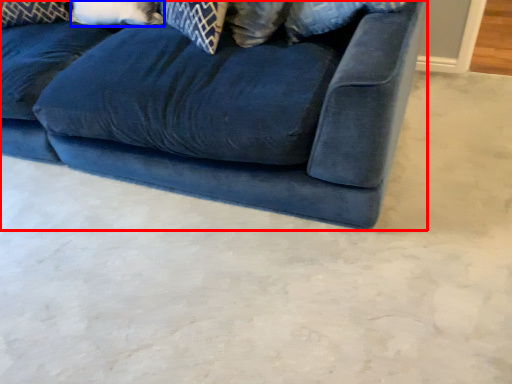
Question: Which object is further to the camera taking this photo, studio couch (highlighted by a red box) or pillow (highlighted by a blue box)?

Choices:
 (A) studio couch
 (B) pillow

Answer: (B)